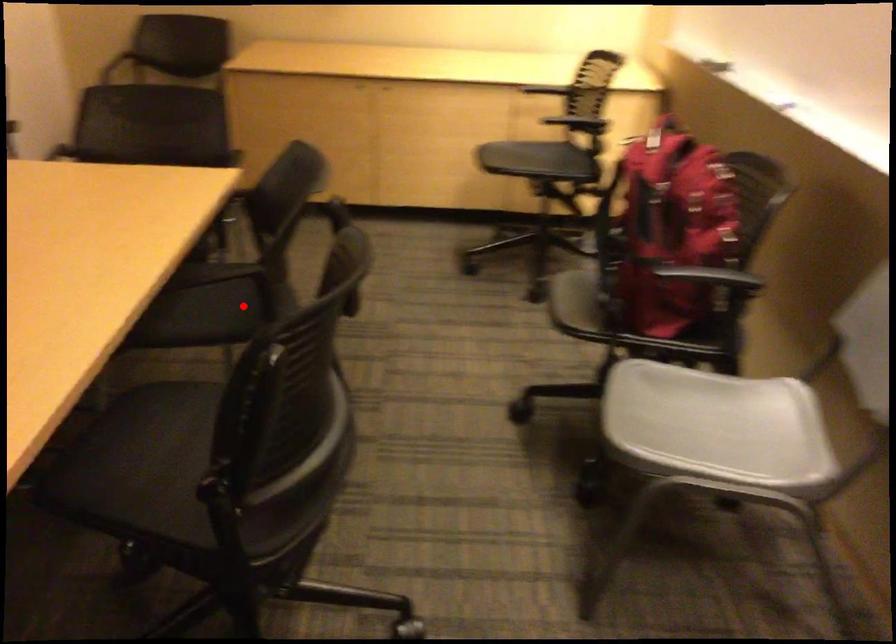
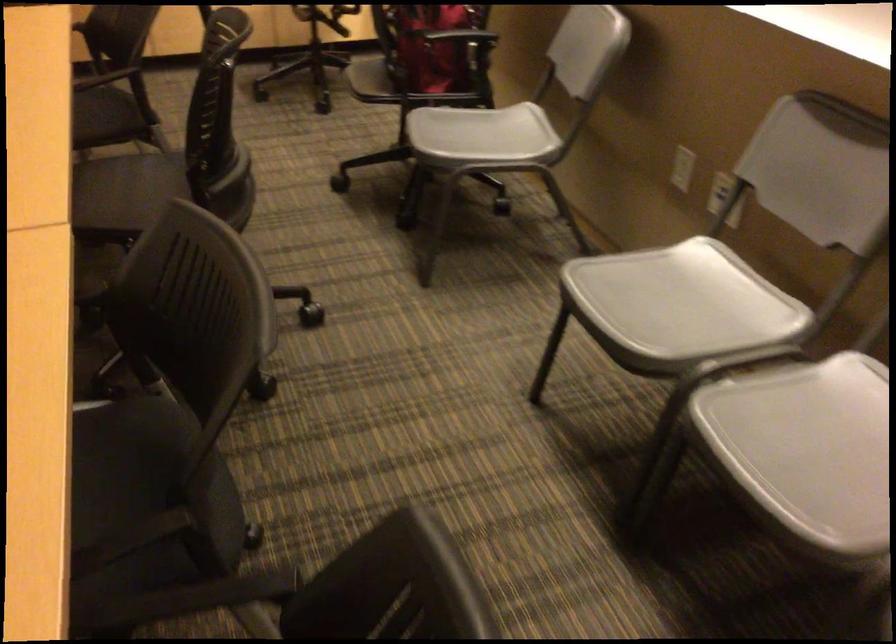
Locate, in the second image, the point that corresponds to the highlighted location in the first image.

(100, 111)